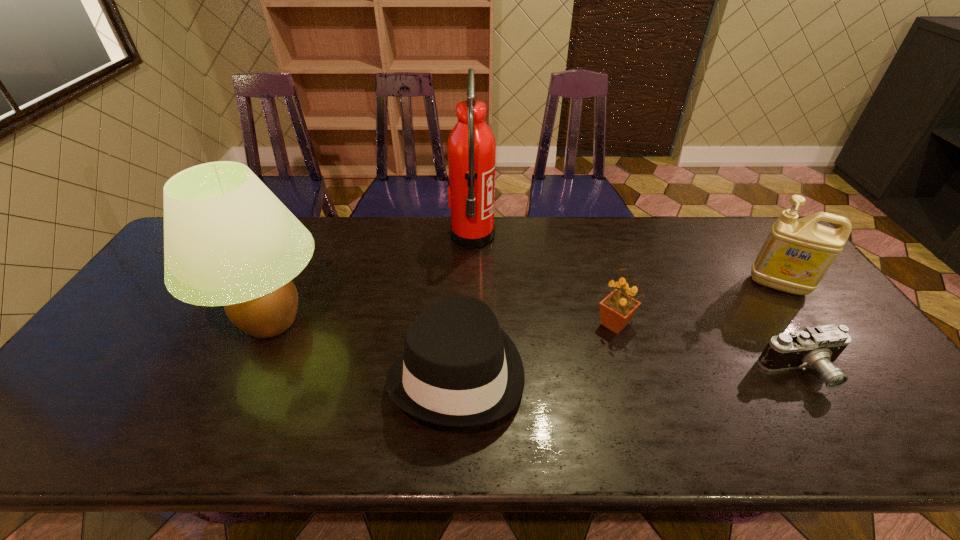
Where is `fire extinguisher`? This screenshot has height=540, width=960. fire extinguisher is located at coordinates (471, 147).

The image size is (960, 540). I want to click on lampshade, so click(229, 241).

Locate an element on the screen. This screenshot has width=960, height=540. the fifth shortest object is located at coordinates 229,241.

Where is `the fourth shortest object`? This screenshot has width=960, height=540. the fourth shortest object is located at coordinates (797, 253).

Where is `the fourth object from left to right`? This screenshot has height=540, width=960. the fourth object from left to right is located at coordinates tap(616, 310).

Image resolution: width=960 pixels, height=540 pixels. What are the coordinates of `fedora` in the screenshot? It's located at pos(459,369).

The image size is (960, 540). Identify the location of camera. (818, 347).

At what (x,y) coordinates should I click in order to perform the action: click on free region located on the label side of the farthest object. Please return your answer as a coordinate pair (x, y). Looking at the image, I should click on (584, 237).

This screenshot has height=540, width=960. I want to click on free region located 0.330m on the shade of the lampshade, so click(x=453, y=321).

What are the coordinates of `free region located 0.210m on the back of the third tallest object` in the screenshot? It's located at (x=738, y=231).